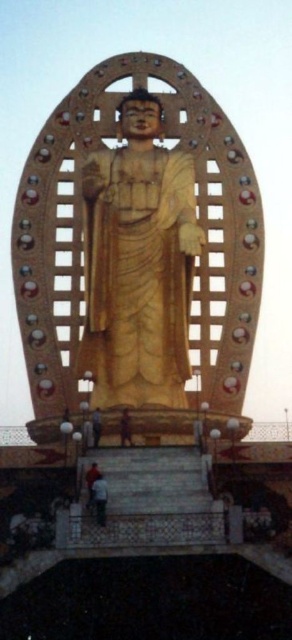
Is orange fabric person at lower center closer to the viewer compared to orange fabric person at lower left?

That is True.

What do you see at coordinates (99, 497) in the screenshot?
I see `orange fabric person at lower center` at bounding box center [99, 497].

Is point (94, 499) farther from viewer compared to point (91, 497)?

That is False.

I want to click on orange fabric person at lower center, so click(99, 497).

Which is more to the left, golden wood statue at center or orange fabric person at lower left?

orange fabric person at lower left is more to the left.

Which of these two, golden wood statue at center or orange fabric person at lower left, stands taller?

golden wood statue at center

Locate an element on the screen. Image resolution: width=292 pixels, height=640 pixels. golden wood statue at center is located at coordinates (138, 262).

Is golden wood statue at center bigger than orange fabric person at lower center?

Yes, golden wood statue at center is bigger than orange fabric person at lower center.

Who is more distant from viewer, (141,134) or (101,515)?

The point (141,134) is behind.

The image size is (292, 640). I want to click on golden wood statue at center, so click(138, 262).